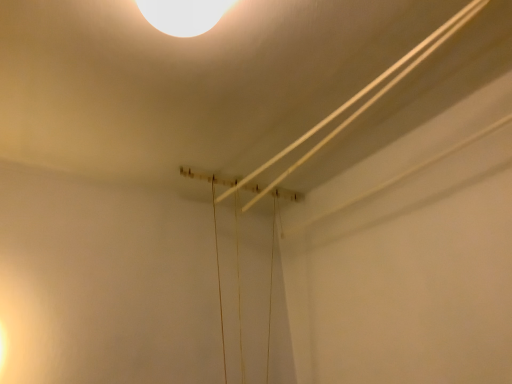
This screenshot has height=384, width=512. What do you see at coordinates (183, 15) in the screenshot?
I see `white glossy light fixture at upper center` at bounding box center [183, 15].

Measure the distance between white glossy light fixture at upper center and camera.

The distance of white glossy light fixture at upper center from camera is 34.37 inches.

The image size is (512, 384). I want to click on white glossy light fixture at upper center, so click(183, 15).

I want to click on white glossy light fixture at upper center, so click(183, 15).